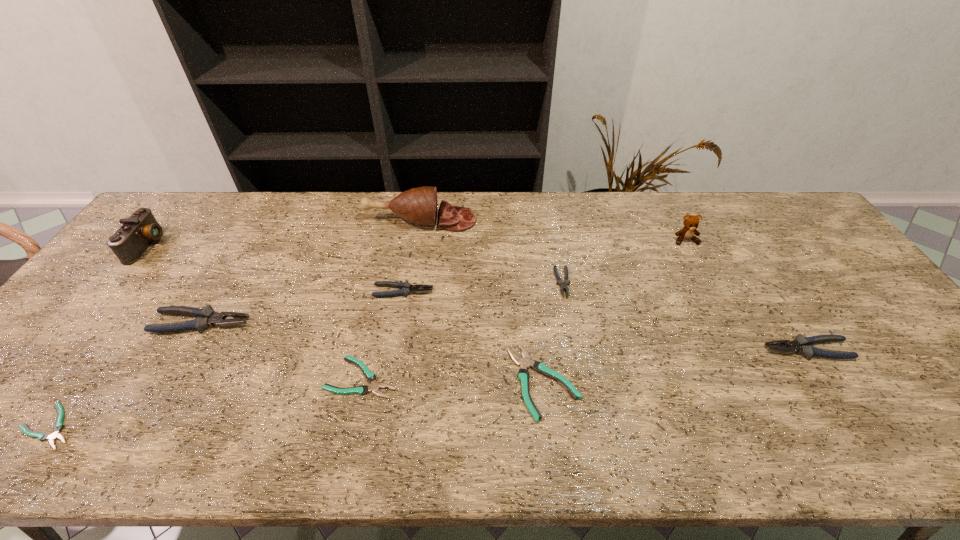
The width and height of the screenshot is (960, 540). I want to click on the tallest object, so click(x=419, y=205).

This screenshot has width=960, height=540. In order to click on brown teddy bear in this screenshot , I will do `click(690, 223)`.

Find the location of a particular element. The image size is (960, 540). the second object from right to left is located at coordinates (690, 223).

The width and height of the screenshot is (960, 540). In order to click on camera in this screenshot , I will do `click(132, 239)`.

Identify the location of the eighth object from right to left. (206, 317).

This screenshot has height=540, width=960. In order to click on the third farthest pliers in this screenshot , I will do `click(206, 317)`.

You are a GUI agent. You are given a task and a screenshot of the screen. Output one action in this format:
    pyautogui.click(x=<x>, y=<y>)
    Task: Click on the rightmost gray pliers
    
    Given the screenshot: What is the action you would take?
    point(803,345)

At what (x,y) coordinates should I click in order to perform the action: click on the second biggest gray pliers. Please return your answer as a coordinate pair (x, y). Looking at the image, I should click on (803, 345).

Locate an element on the screen. The image size is (960, 540). the third tallest pliers is located at coordinates (406, 288).

Find the location of a particular element. Image resolution: width=960 pixels, height=540 pixels. the sixth tallest object is located at coordinates (406, 288).